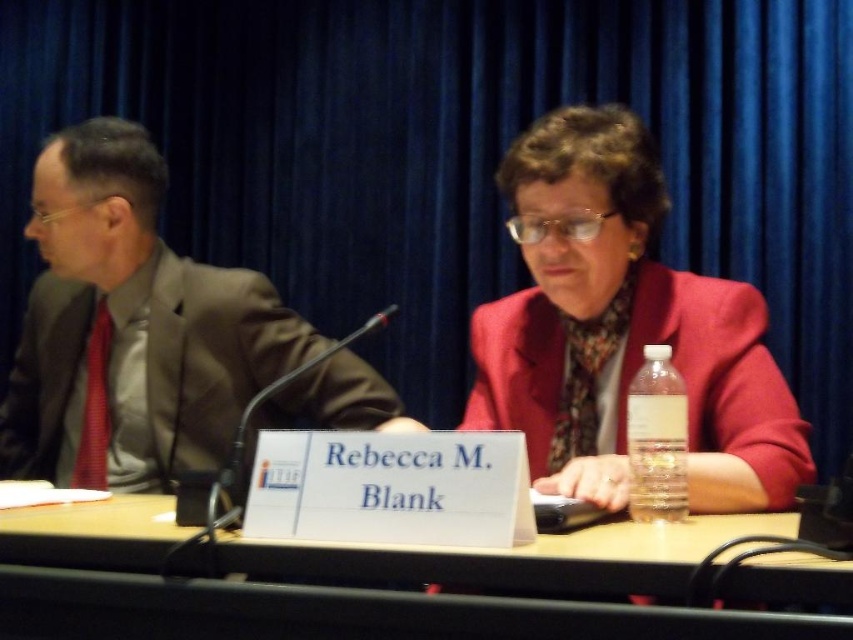
Between matte red blazer at center and wooden table at center, which one has less height?

Standing shorter between the two is wooden table at center.

Is matte red blazer at center wider than wooden table at center?

No.

Who is more distant from viewer, (556,436) or (695,545)?

The point (556,436) is more distant.

The height and width of the screenshot is (640, 853). Identify the location of matte red blazer at center. (624, 330).

Does matte red blazer at center appear under matte brown suit at left?

No, matte red blazer at center is not below matte brown suit at left.

Between matte red blazer at center and matte brown suit at left, which one is positioned lower?

matte brown suit at left

Which is in front, point (515, 145) or point (245, 397)?

Point (515, 145) is in front.

Find the location of a particular element. This screenshot has height=640, width=853. matte red blazer at center is located at coordinates (624, 330).

Is matte brown suit at left behind wooden table at center?

Yes.

Does matte brown suit at left have a larger size compared to wooden table at center?

Yes.

Between point (138, 336) and point (653, 588), which one is positioned in front?

Point (653, 588)

Locate an element on the screen. matte brown suit at left is located at coordinates (131, 328).